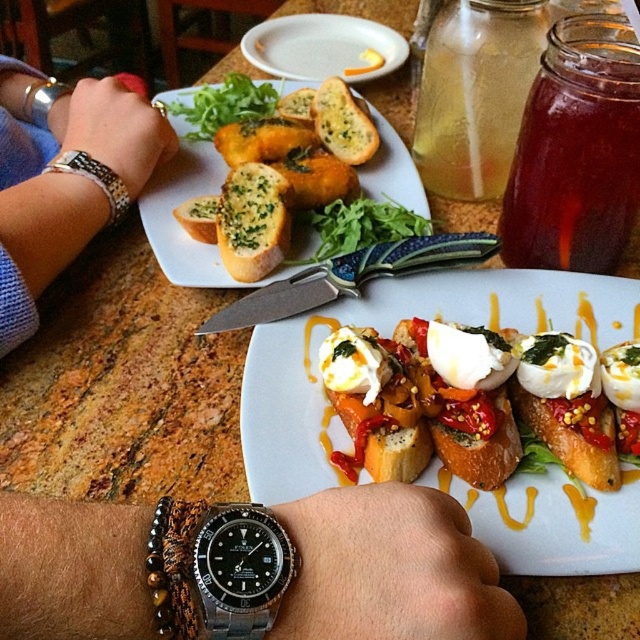
Question: Which point is closer to the camera?

Choices:
 (A) (45, 108)
 (B) (529, 397)
 (C) (273, 436)

Answer: (C)

Question: Is golden-brown bread at center bigger than black metal watch at upper left?

Choices:
 (A) yes
 (B) no

Answer: (A)

Question: Among these objects, which one is farthest from the camera?

Choices:
 (A) black metal watch at upper left
 (B) silver metallic watch at upper left

Answer: (A)

Question: Does translucent glass jar at upper right lie in front of breadgolden-brown crustyat center-left?

Choices:
 (A) yes
 (B) no

Answer: (A)

Question: Which object is closer to the camera taking this photo?

Choices:
 (A) breadgolden-brown crustyat center-left
 (B) black metal watch at upper left
 (C) golden-brown bread at center
 (D) black metal watch at lower left

Answer: (D)

Question: Does white ceramic plate at center have a greater width compared to black metal watch at lower left?

Choices:
 (A) yes
 (B) no

Answer: (A)